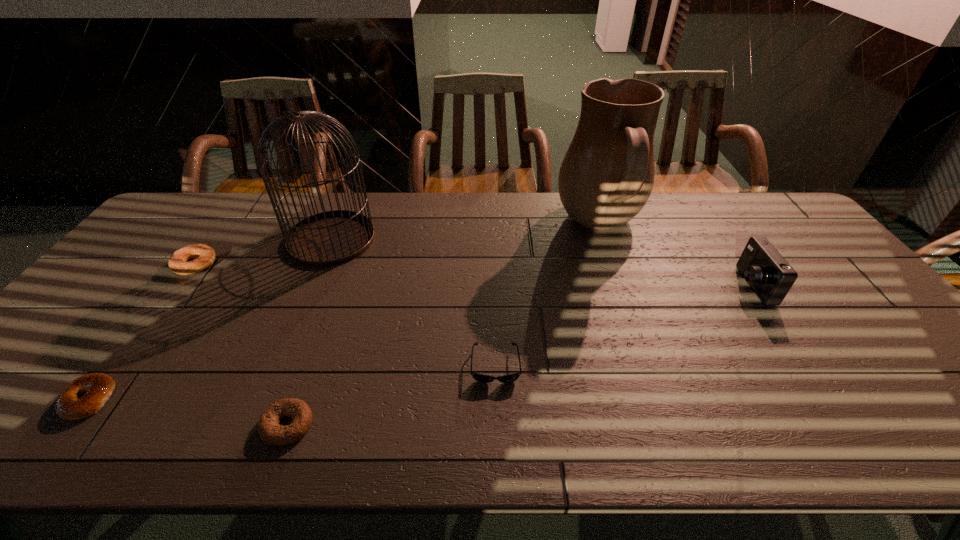
Locate which object ranks fifth in proximity to the birdcage. Please provide its 2D coordinates. Your answer should be formatted as a tuple, i.e. [(x, y)], where the tuple contains the x and y coordinates of a point satisfying the conditions above.

[(607, 175)]

Where is `object identified as the fourth closest to the tallest bagel`? This screenshot has height=540, width=960. object identified as the fourth closest to the tallest bagel is located at coordinates (482, 378).

I want to click on the second closest bagel to the birdcage, so click(x=98, y=386).

Point out which bagel is positioned as the second nearest to the farthest bagel. Please provide its 2D coordinates. Your answer should be formatted as a tuple, i.e. [(x, y)], where the tuple contains the x and y coordinates of a point satisfying the conditions above.

[(269, 430)]